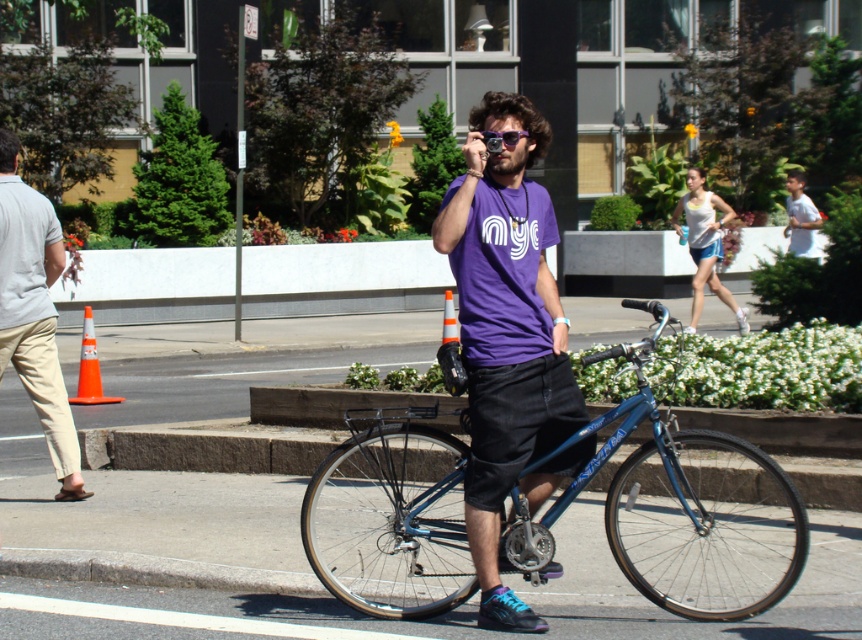
Question: Which object is farther from the camera taking this photo?

Choices:
 (A) white cotton shirt at upper right
 (B) orange traffic cone at left
 (C) light beige pants at left
 (D) purple reflective sunglasses at center

Answer: (B)

Question: Can you confirm if blue metallic bicycle at center is positioned to the left of light beige pants at left?

Choices:
 (A) no
 (B) yes

Answer: (A)

Question: Which object is farther from the camera taking this photo?

Choices:
 (A) purple matte t-shirt at center
 (B) white cotton shirt at upper right
 (C) orange traffic cone at left

Answer: (C)

Question: Among these objects, which one is farthest from the camera?

Choices:
 (A) white cotton shirt at upper right
 (B) orange plastic traffic cone at center
 (C) blue metallic bicycle at center
 (D) purple matte t-shirt at center

Answer: (B)

Question: Does blue metallic bicycle at center have a smaller size compared to white cotton shirt at upper right?

Choices:
 (A) no
 (B) yes

Answer: (B)

Question: Does blue metallic bicycle at center appear over orange traffic cone at left?

Choices:
 (A) no
 (B) yes

Answer: (A)